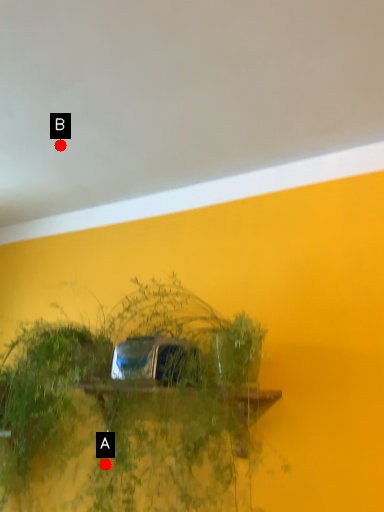
Question: Two points are circled on the image, labeled by A and B beside each circle. Among these points, which one is farthest from the camera?

Choices:
 (A) A is further
 (B) B is further

Answer: (B)